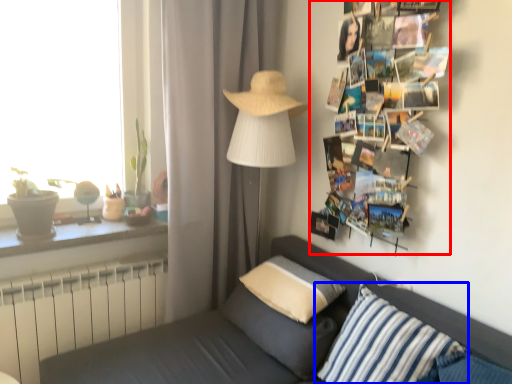
Question: Which of the following is the farthest to the observer, magazine (highlighted by a red box) or pillow (highlighted by a blue box)?

Choices:
 (A) magazine
 (B) pillow

Answer: (A)